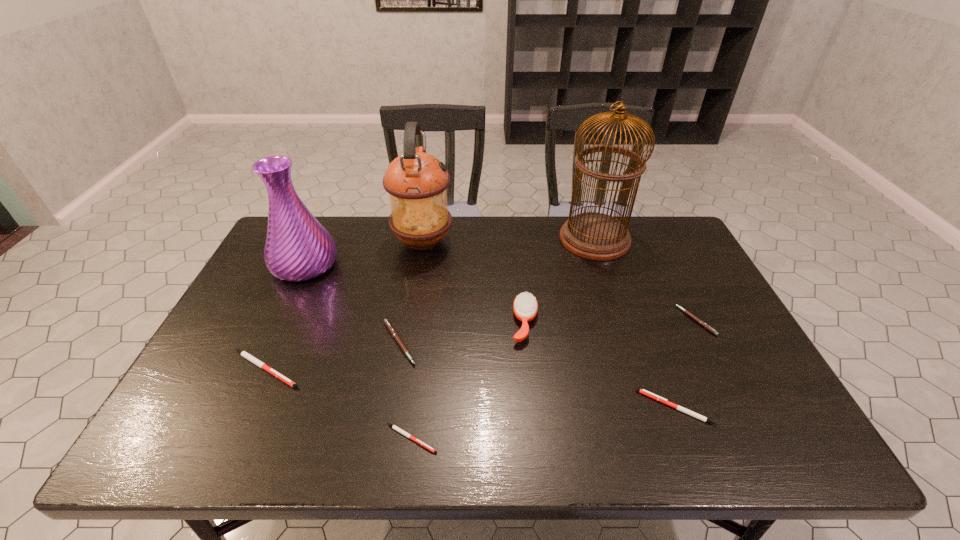
Find the location of `free space located 0.300m on the left of the hairbrush`. free space located 0.300m on the left of the hairbrush is located at coordinates (401, 322).

Where is `vacant space located at the nib of the bigger pink pen`? vacant space located at the nib of the bigger pink pen is located at coordinates (473, 343).

Locate an element on the screen. blank space located 0.350m on the clicker of the farthest white pen is located at coordinates (447, 369).

Find the location of a particular element. free space located 0.340m at the nib of the rightmost pen is located at coordinates (558, 321).

Where is `vacant space located 0.060m at the nib of the rightmost pen`? vacant space located 0.060m at the nib of the rightmost pen is located at coordinates (660, 321).

Locate an element on the screen. The width and height of the screenshot is (960, 540). free space located 0.400m at the nib of the rightmost pen is located at coordinates (536, 321).

Where is `free point located on the clicker of the rightmost white pen`? free point located on the clicker of the rightmost white pen is located at coordinates (531, 408).

The image size is (960, 540). Find the location of `vacant space situated 0.400m on the clicker of the rightmost white pen`. vacant space situated 0.400m on the clicker of the rightmost white pen is located at coordinates (465, 408).

At what (x,y) coordinates should I click in order to perform the action: click on free location located on the clicker of the rightmost white pen. Please return your answer as a coordinate pair (x, y). The image size is (960, 540). Looking at the image, I should click on (540, 408).

I want to click on free space located on the clicker of the shortest object, so click(x=522, y=438).